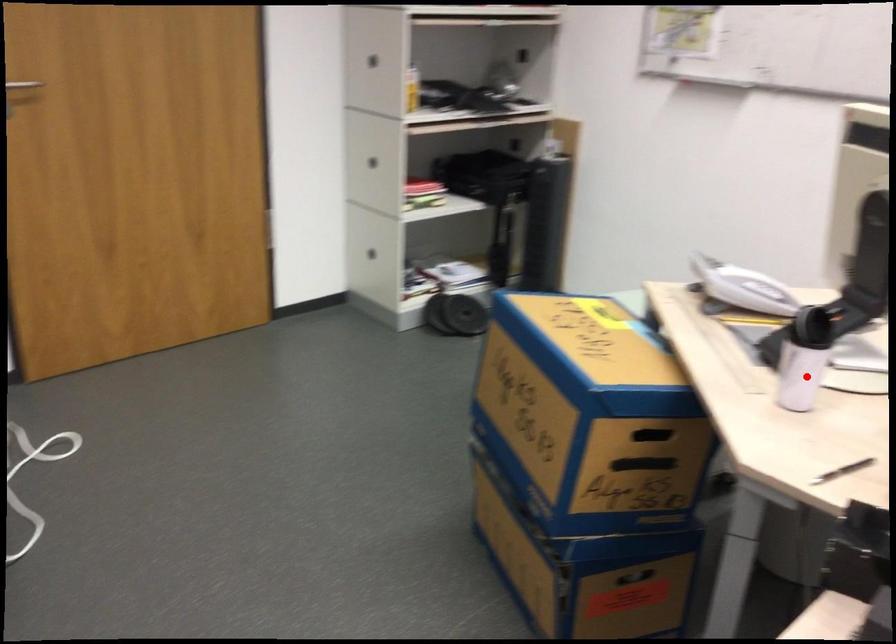
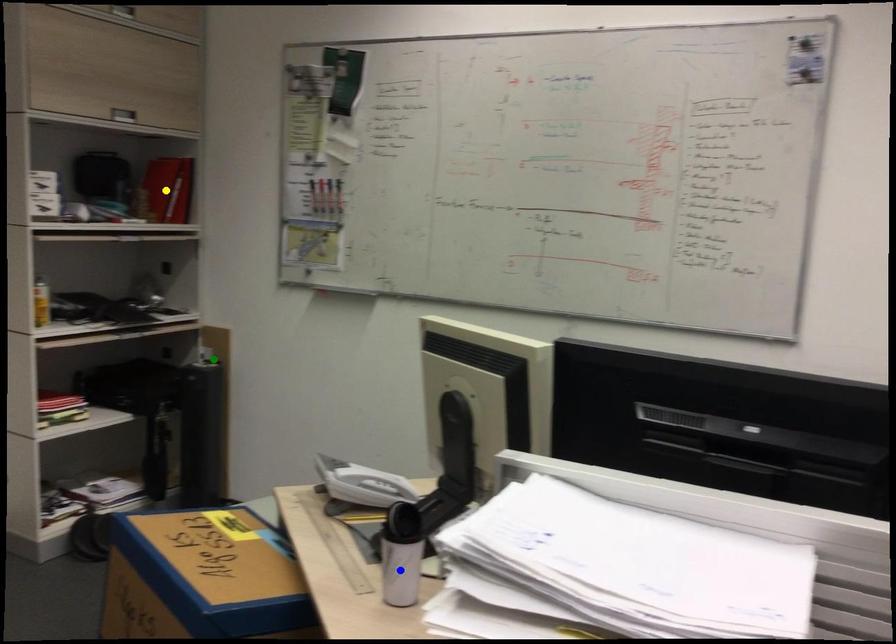
Question: I am providing you with two images of the same scene from different viewpoints. A red point is marked on the first image. You are given multiple points on the second image. Can you choose the point in image 2 that corresponds to the point in image 1?

Choices:
 (A) blue point
 (B) green point
 (C) yellow point

Answer: (A)